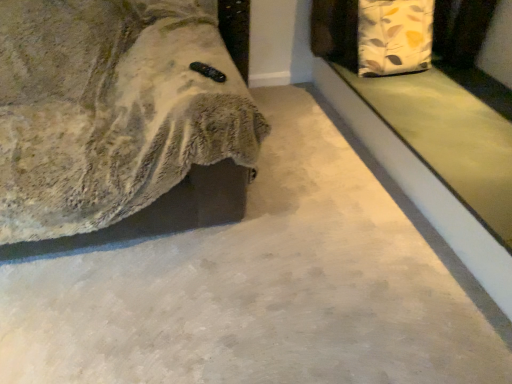
What do you see at coordinates (111, 110) in the screenshot? This screenshot has height=384, width=512. I see `fuzzy fabric blanket at left` at bounding box center [111, 110].

Where is `fuzzy fabric blanket at left`? Image resolution: width=512 pixels, height=384 pixels. fuzzy fabric blanket at left is located at coordinates (111, 110).

Locate an element on the screen. fuzzy fabric blanket at left is located at coordinates (111, 110).